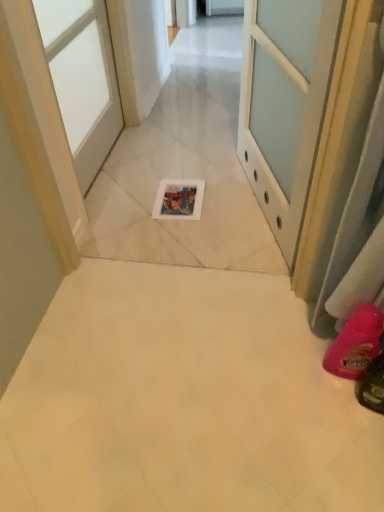
I want to click on free space to the left of pink rubber boot at lower right, so tap(292, 374).